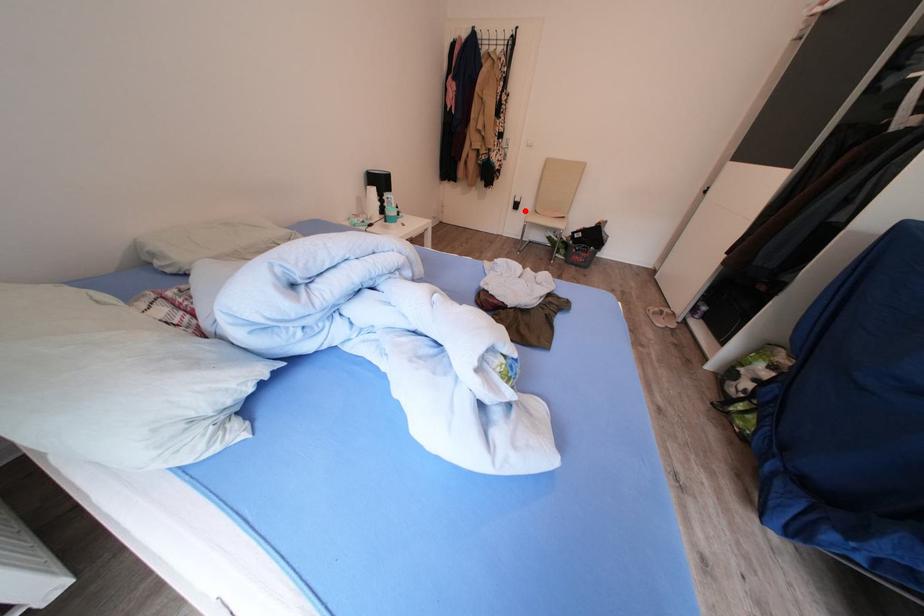
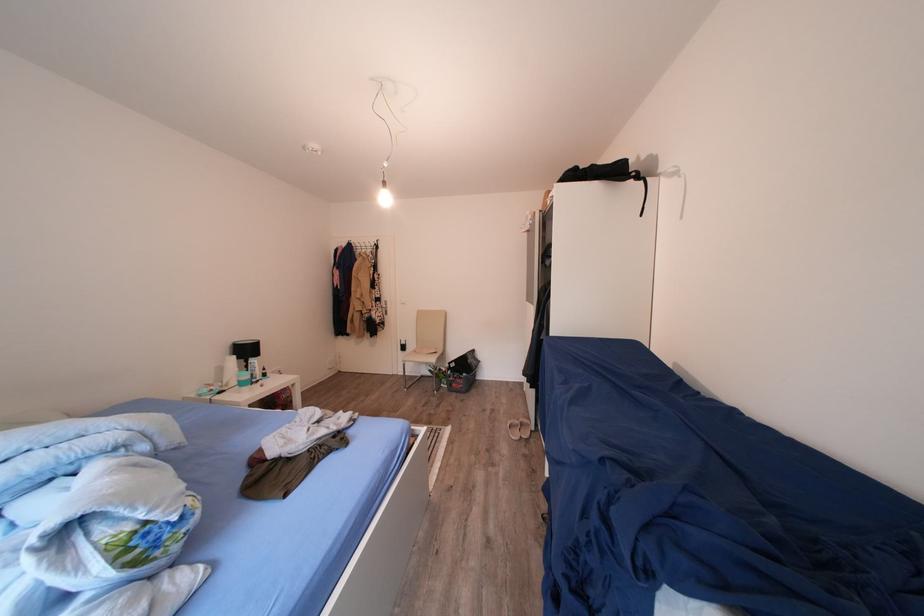
The point at the highlighted location is marked in the first image. Where is the corresponding point in the second image?

(411, 353)